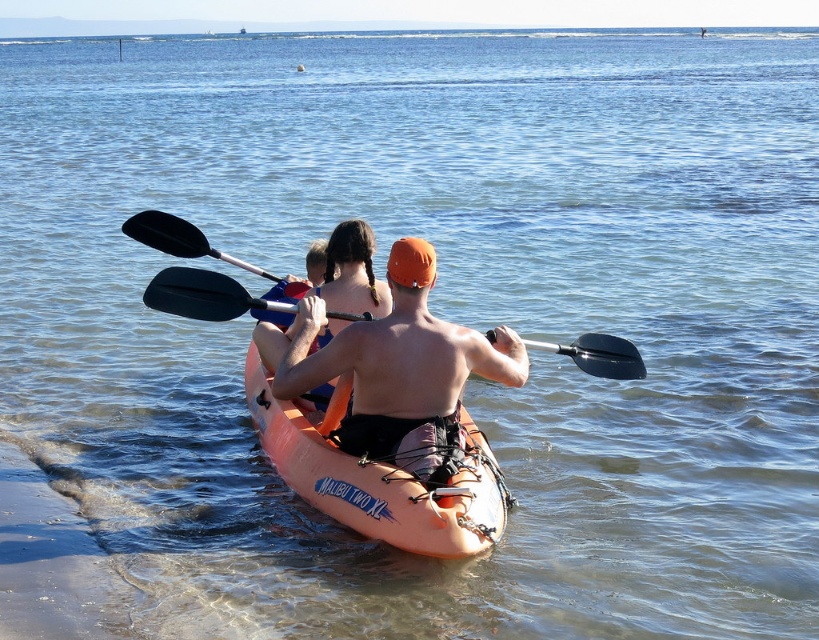
Question: Can you confirm if orange fabric shirt at center is wider than orange matte kayak at center?

Choices:
 (A) no
 (B) yes

Answer: (A)

Question: Estimate the real-world distances between objects in this image. Which object is closer to the orange matte kayak at center?

Choices:
 (A) black rubber paddle at center
 (B) orange fabric shirt at center

Answer: (B)

Question: Does orange fabric shirt at center have a larger size compared to orange matte kayak at center?

Choices:
 (A) yes
 (B) no

Answer: (B)

Question: Which point is closer to the camera?

Choices:
 (A) orange matte kayak at center
 (B) black rubber paddle at center

Answer: (A)

Question: Which object is the closest to the orange fabric shirt at center?

Choices:
 (A) black rubber paddle at center
 (B) orange matte kayak at center

Answer: (B)

Question: From the image, what is the correct spatial relationship of orange fabric shirt at center in relation to black rubber paddle at center?

Choices:
 (A) left
 (B) right

Answer: (B)